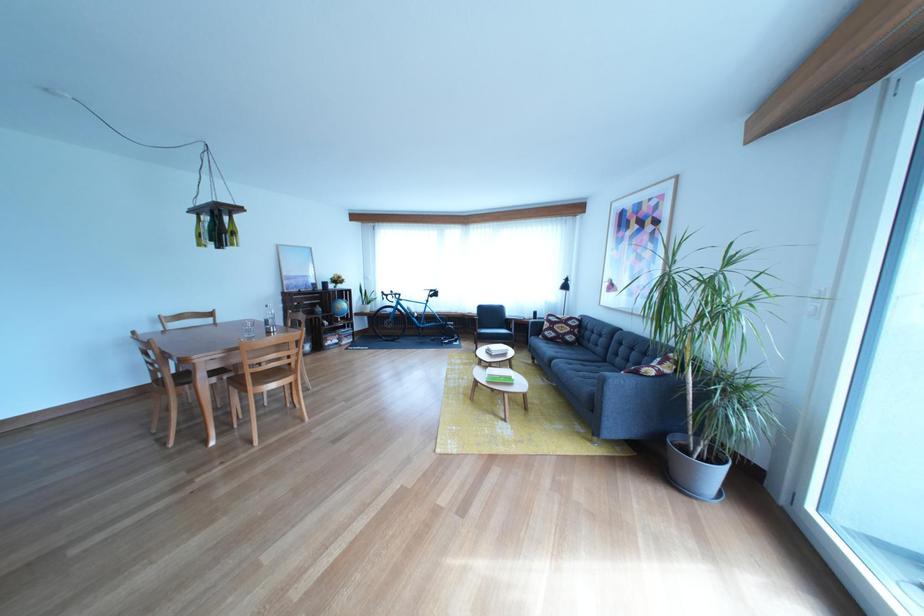
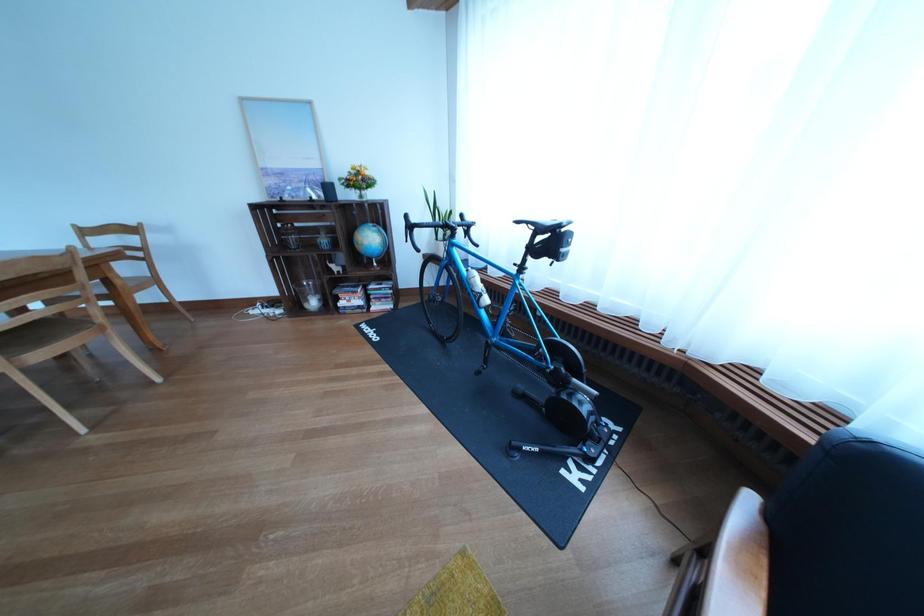
In the second image, find the point that corresponds to point (417, 314) in the first image.

(470, 277)